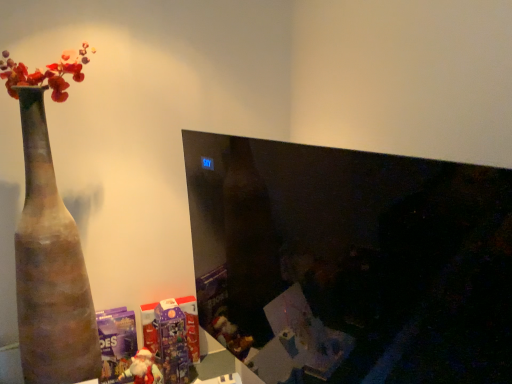
Question: Is black glossy monitor at center outside of terracotta vase at left?

Choices:
 (A) no
 (B) yes

Answer: (B)

Question: From a real-world perspective, is black glossy monitor at center on terracotta vase at left?

Choices:
 (A) no
 (B) yes

Answer: (B)

Question: Does black glossy monitor at center have a larger size compared to terracotta vase at left?

Choices:
 (A) yes
 (B) no

Answer: (B)

Question: Considering the relative sizes of black glossy monitor at center and terracotta vase at left in the image provided, is black glossy monitor at center smaller than terracotta vase at left?

Choices:
 (A) yes
 (B) no

Answer: (A)

Question: Can you confirm if black glossy monitor at center is taller than terracotta vase at left?

Choices:
 (A) yes
 (B) no

Answer: (B)

Question: Would you consider black glossy monitor at center to be distant from terracotta vase at left?

Choices:
 (A) no
 (B) yes

Answer: (A)

Question: Is terracotta vase at left facing towards purple glossy advent calendar at lower center, the 2th toy when ordered from front to back?

Choices:
 (A) yes
 (B) no

Answer: (B)

Question: Can you confirm if terracotta vase at left is shorter than purple glossy advent calendar at lower center, the 1th toy viewed from the back?

Choices:
 (A) no
 (B) yes

Answer: (A)

Question: From the image's perspective, is terracotta vase at left located above purple glossy advent calendar at lower center, the 1th toy viewed from the back?

Choices:
 (A) yes
 (B) no

Answer: (A)

Question: Is terracotta vase at left to the left of purple glossy advent calendar at lower center, the 1th toy viewed from the back, from the viewer's perspective?

Choices:
 (A) yes
 (B) no

Answer: (A)

Question: Would you say terracotta vase at left contains purple glossy advent calendar at lower center, the 2th toy when ordered from front to back?

Choices:
 (A) yes
 (B) no

Answer: (B)

Question: From a real-world perspective, is terracotta vase at left positioned under purple glossy advent calendar at lower center, the 1th toy viewed from the back, based on gravity?

Choices:
 (A) yes
 (B) no

Answer: (B)

Question: Are terracotta vase at left and matte plastic santa at lower left, which ranks as the first toy in front-to-back order, making contact?

Choices:
 (A) yes
 (B) no

Answer: (B)